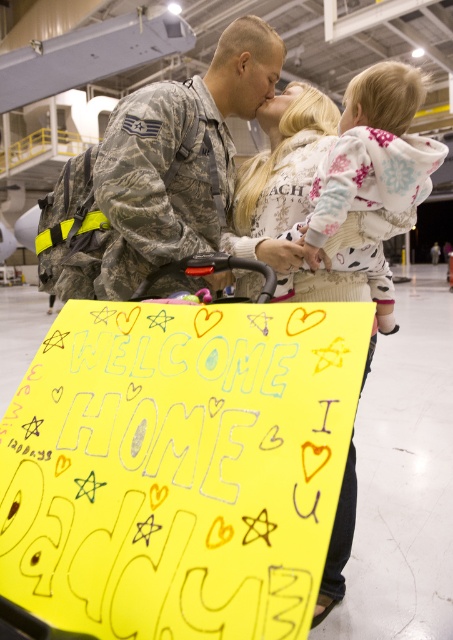
From the picture: Does camouflage uniform at center appear over white fleece sweater at center?

Yes.

Does camouflage uniform at center have a greater height compared to white fleece sweater at center?

No.

What do you see at coordinates (173, 157) in the screenshot? This screenshot has height=640, width=453. I see `camouflage uniform at center` at bounding box center [173, 157].

Where is `camouflage uniform at center`? camouflage uniform at center is located at coordinates pyautogui.click(x=173, y=157).

Does camouflage uniform at center appear over white fleece hoodie at upper center?

Indeed, camouflage uniform at center is positioned over white fleece hoodie at upper center.

Which is below, camouflage uniform at center or white fleece hoodie at upper center?

Positioned lower is white fleece hoodie at upper center.

Locate an element on the screen. The width and height of the screenshot is (453, 640). camouflage uniform at center is located at coordinates point(173,157).

Consider the image. Is white fleece sweater at center thinner than white fleece hoodie at upper center?

In fact, white fleece sweater at center might be wider than white fleece hoodie at upper center.

Can you confirm if white fleece sweater at center is bigger than white fleece hoodie at upper center?

Yes.

Who is more distant from viewer, (369, 256) or (346, 269)?

The point (346, 269) is behind.

Identify the location of white fleece sweater at center. (289, 196).